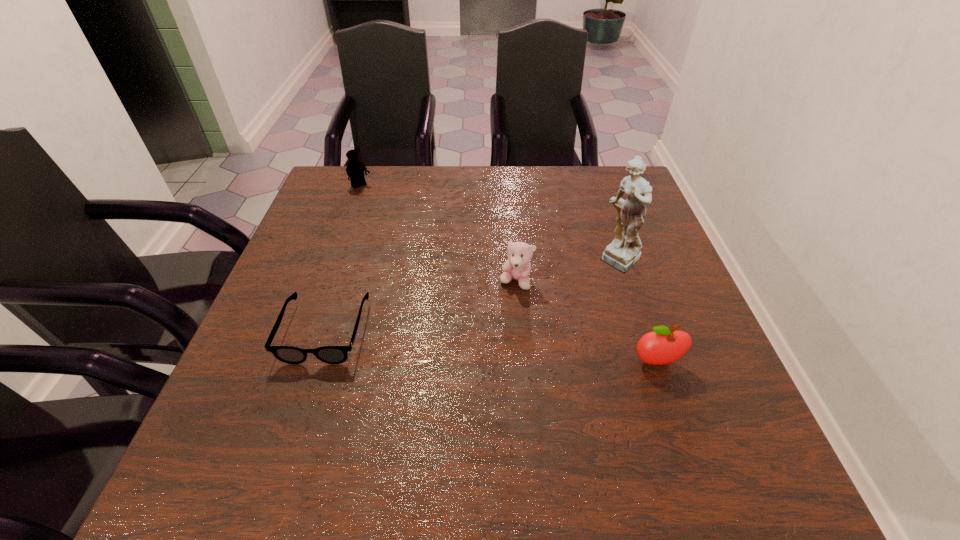
Find the location of a particular element. The image size is (960, 540). figurine that is at the right edge is located at coordinates (624, 252).

This screenshot has width=960, height=540. In order to click on object that is at the far left corner in this screenshot , I will do `click(355, 169)`.

Identify the location of free point at the far edge. (513, 201).

You are a GUI agent. You are given a task and a screenshot of the screen. Output one action in this format:
    pyautogui.click(x=<x>, y=<y>)
    Task: Click on the vacant region at the near edge
    The image size is (960, 540).
    Given the screenshot: What is the action you would take?
    pyautogui.click(x=452, y=422)

This screenshot has height=540, width=960. In the image, there is a desktop. What are the coordinates of `vacant space at the left edge` in the screenshot? It's located at (x=303, y=236).

The width and height of the screenshot is (960, 540). What are the coordinates of `vacant space at the right edge of the desktop` in the screenshot? It's located at (654, 303).

This screenshot has height=540, width=960. What are the coordinates of `vacant space at the far left corner of the desktop` in the screenshot? It's located at (372, 176).

The width and height of the screenshot is (960, 540). Find the location of `vacant space at the near left corner of the desktop`. vacant space at the near left corner of the desktop is located at coordinates (231, 406).

I want to click on vacant area at the far right corner of the desktop, so click(x=627, y=172).

Find the location of a particular element. The height and width of the screenshot is (540, 960). vacant space at the near right corner of the desktop is located at coordinates (660, 416).